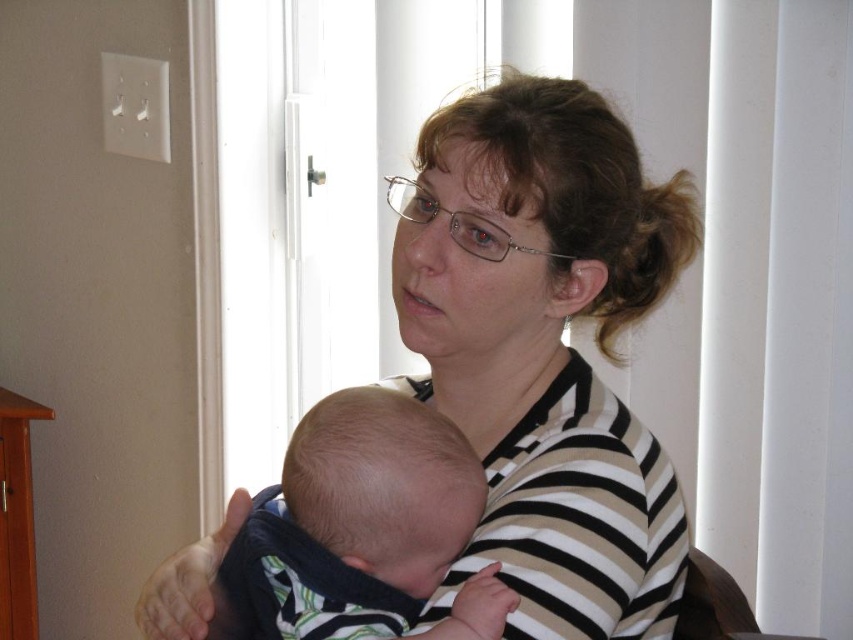
You are a photographer trying to capture a portrait of the striped fabric woman at center and the soft white baby at center. Since the doorway is the main light source, you need to ensure both subjects are well lit. Given their heights, which subject might naturally receive more light from the doorway, and why?

The striped fabric woman at center is taller than the soft white baby at center, so she might naturally receive more light from the doorway since her height places her face closer to the light source.

You are a photographer trying to capture the striped fabric woman at center. You need to adjust your camera settings based on the position of the point at coordinates point (547,348). What is the significance of this point in relation to the striped fabric woman at center?

The point at coordinates point (547,348) corresponds to the striped fabric woman at center, indicating that this point is part of her clothing or position in the image.

Based on the photo, you are a photographer trying to capture a closeup shot of the striped fabric woman at center and the soft white baby at center. Given that your camera can only focus on one subject at a time, which subject should you choose to ensure the larger one is in focus?

The striped fabric woman at center is larger than the soft white baby at center, so you should focus on the striped fabric woman at center to ensure the larger subject is in focus.